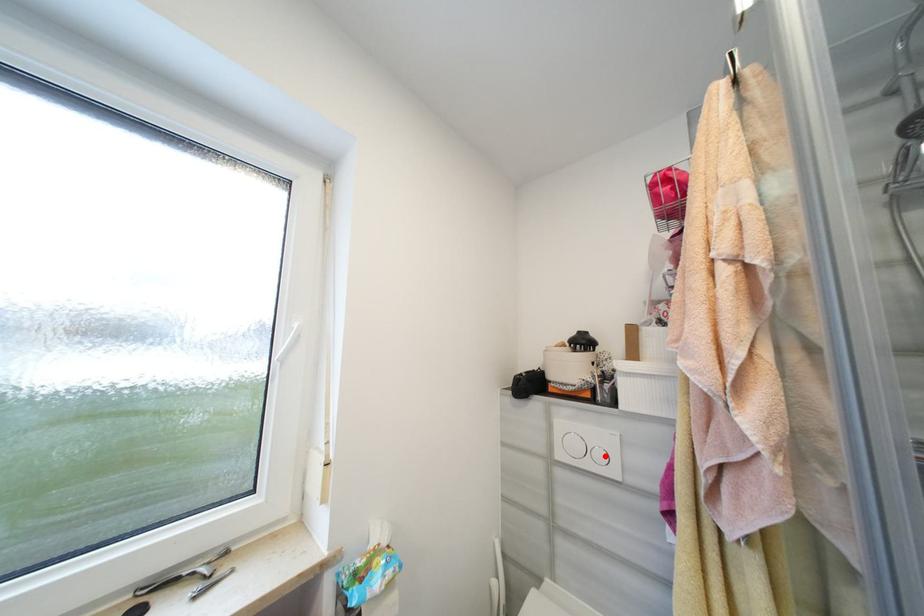
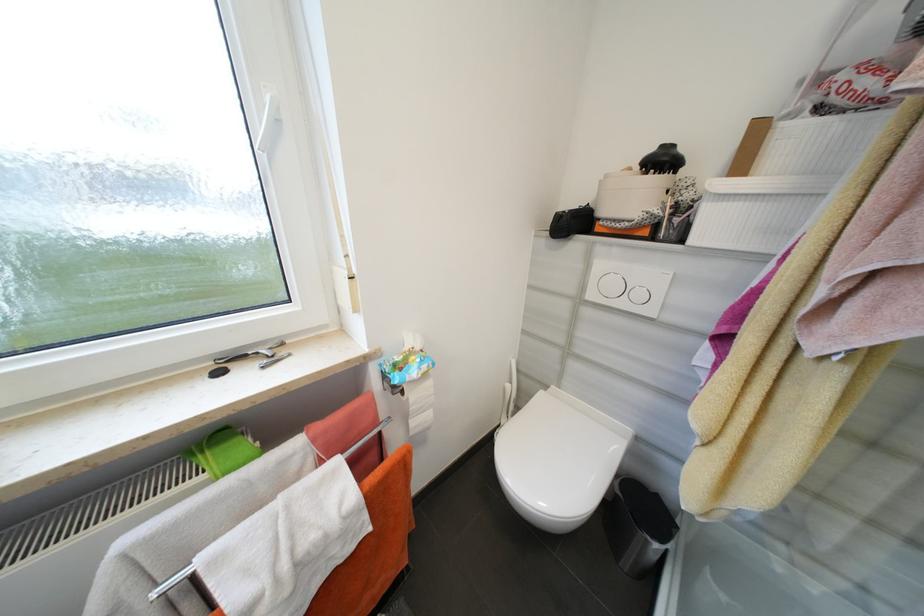
Find the pixel in the second image that matches the highlighted location in the first image.

(646, 296)